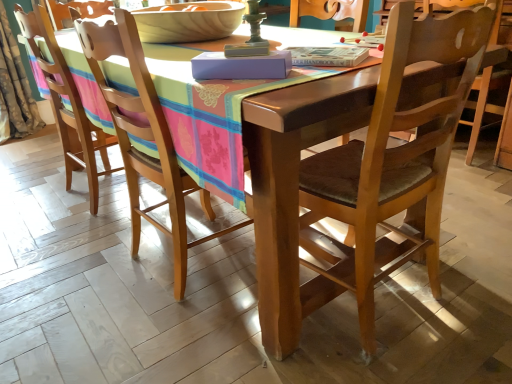
Question: Is wooden chair at center, which is counted as the 1th chair, starting from the right, wider or thinner than wooden chair at center, positioned as the first chair in left-to-right order?

Choices:
 (A) wide
 (B) thin

Answer: (B)

Question: Considering the positions of wooden chair at center, which is counted as the 1th chair, starting from the right, and wooden chair at center, which ranks as the 3th chair in right-to-left order, in the image, is wooden chair at center, which is counted as the 1th chair, starting from the right, bigger or smaller than wooden chair at center, which ranks as the 3th chair in right-to-left order,?

Choices:
 (A) small
 (B) big

Answer: (A)

Question: Which of these objects is positioned farthest from the camouflage fabric curtain at left?

Choices:
 (A) wooden chair at center, which is counted as the third chair, starting from the left
 (B) wooden chair at center, which ranks as the 3th chair in right-to-left order
 (C) wooden chair at left, arranged as the second chair when viewed from the left
 (D) wooden bowl at upper center

Answer: (A)

Question: Estimate the real-world distances between objects in this image. Which object is closer to the wooden bowl at upper center?

Choices:
 (A) wooden chair at left, which is the second chair from right to left
 (B) wooden chair at center, which is counted as the third chair, starting from the left
 (C) camouflage fabric curtain at left
 (D) wooden chair at center, positioned as the first chair in left-to-right order

Answer: (A)